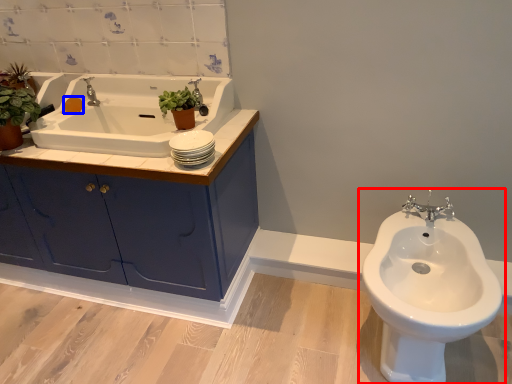
Question: Which of the following is the farthest to the observer, toilet (highlighted by a red box) or soap (highlighted by a blue box)?

Choices:
 (A) toilet
 (B) soap

Answer: (B)